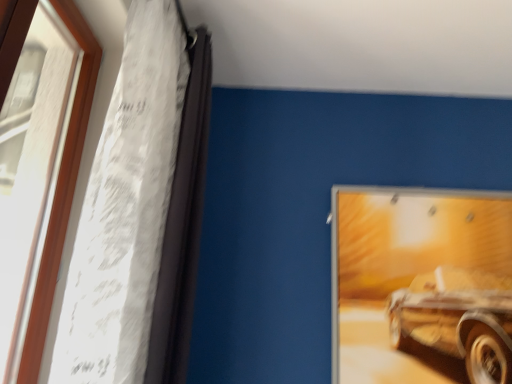
Question: From the image's perspective, relative to white sheer fabric at left, is wooden frame at left above or below?

Choices:
 (A) above
 (B) below

Answer: (B)

Question: Is wooden frame at left inside the boundaries of white sheer fabric at left, or outside?

Choices:
 (A) outside
 (B) inside

Answer: (A)

Question: Estimate the real-world distances between objects in this image. Which object is closer to the white sheer fabric at left?

Choices:
 (A) wooden frame at left
 (B) metallic silver picture frame at upper right

Answer: (A)

Question: Which object is positioned closest to the wooden frame at left?

Choices:
 (A) metallic silver picture frame at upper right
 (B) white sheer fabric at left

Answer: (B)